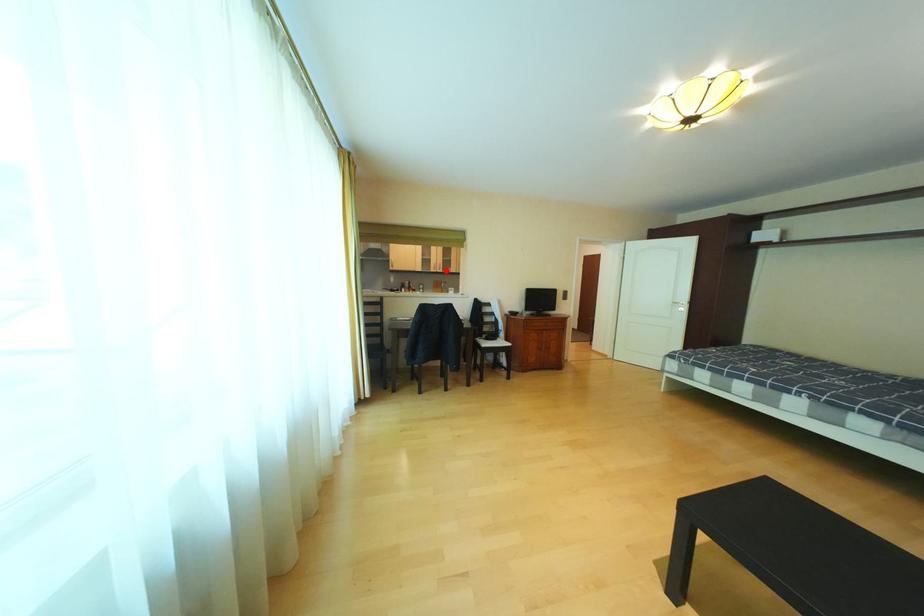
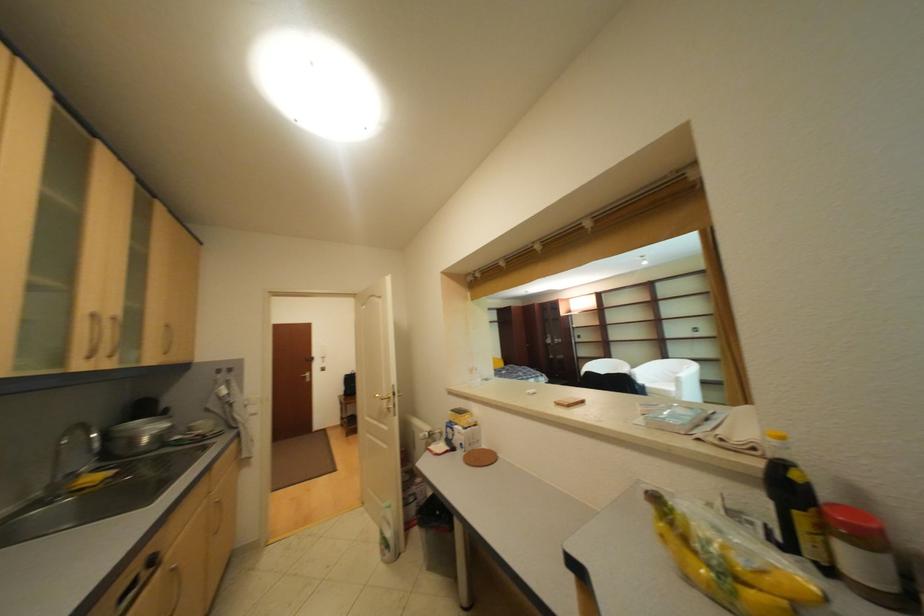
Question: I am providing you with two images of the same scene from different viewpoints. Given a red point in image1, look at the same physical point in image2. Is it:

Choices:
 (A) Closer to the viewpoint
 (B) Farther from the viewpoint

Answer: (B)